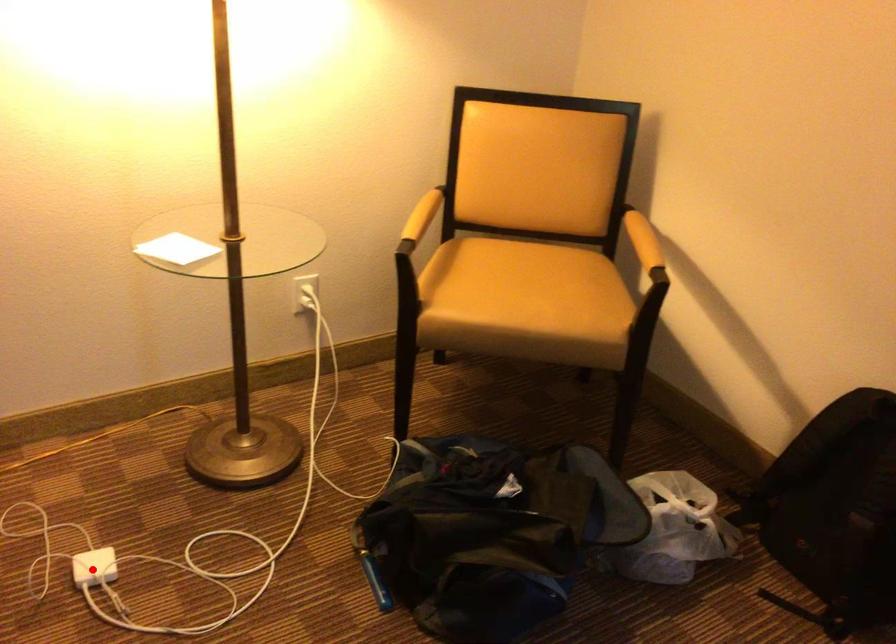
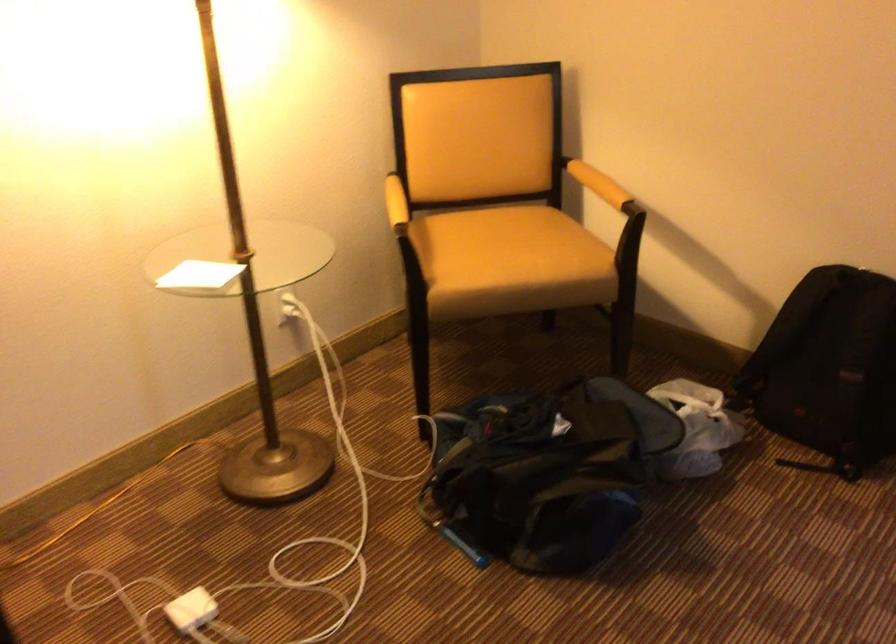
Where in the second image is the point corresponding to the highlighted location from the first image?

(192, 609)